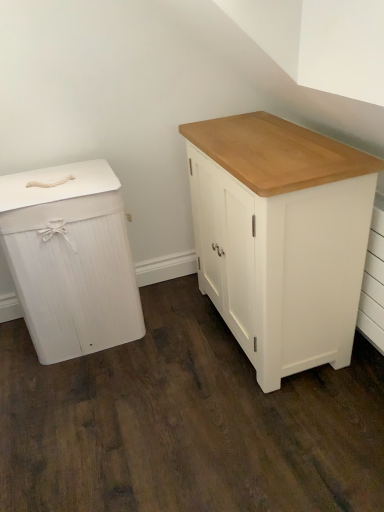
Locate an element on the screen. free space in front of white wood chest of drawers at left, the first chest of drawers positioned from the left is located at coordinates (97, 406).